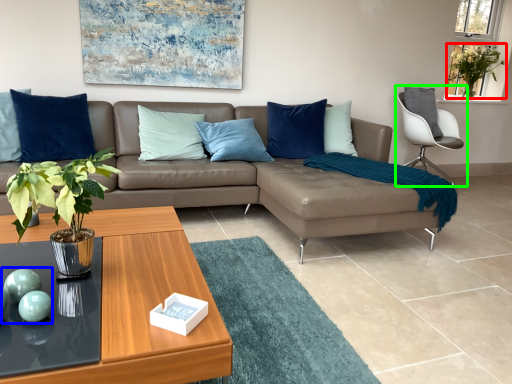
Question: Which object is the closest to the plant (highlighted by a red box)? Choose among these: teal (highlighted by a blue box) or chair (highlighted by a green box).

Choices:
 (A) teal
 (B) chair

Answer: (B)